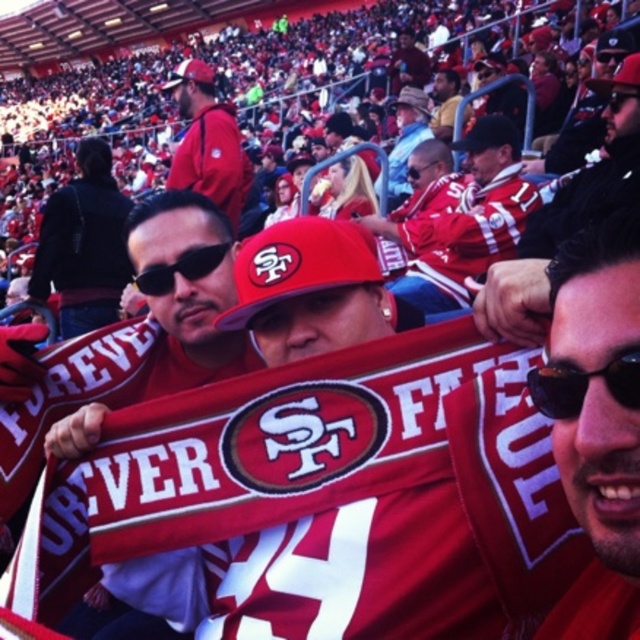
Question: Does matte red cap at upper center appear under black plastic goggles at right?

Choices:
 (A) yes
 (B) no

Answer: (B)

Question: Does black matte sunglasses at center have a smaller size compared to black plastic sunglasses at center?

Choices:
 (A) no
 (B) yes

Answer: (B)

Question: Which point appears farthest from the camera in this image?

Choices:
 (A) (600, 435)
 (B) (182, 612)
 (C) (173, 280)

Answer: (C)

Question: Which of the following is the closest to the observer?

Choices:
 (A) sunglasses at center
 (B) black plastic goggles at right

Answer: (A)

Question: Among these objects, which one is farthest from the camera?

Choices:
 (A) matte red cap at upper center
 (B) black plastic goggles at right
 (C) black plastic sunglasses at center

Answer: (C)

Question: Is matte red scarf at center bigger than black plastic goggles at right?

Choices:
 (A) yes
 (B) no

Answer: (A)